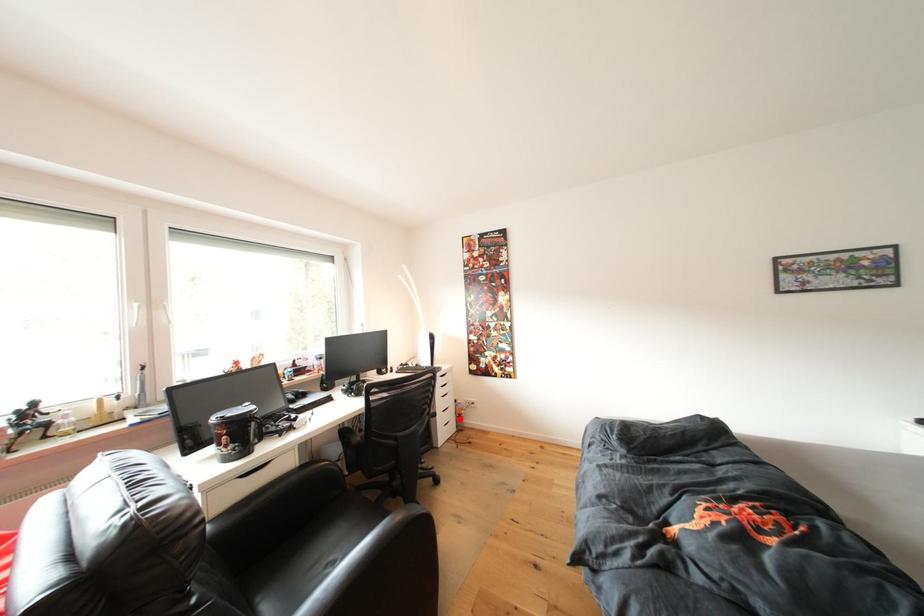
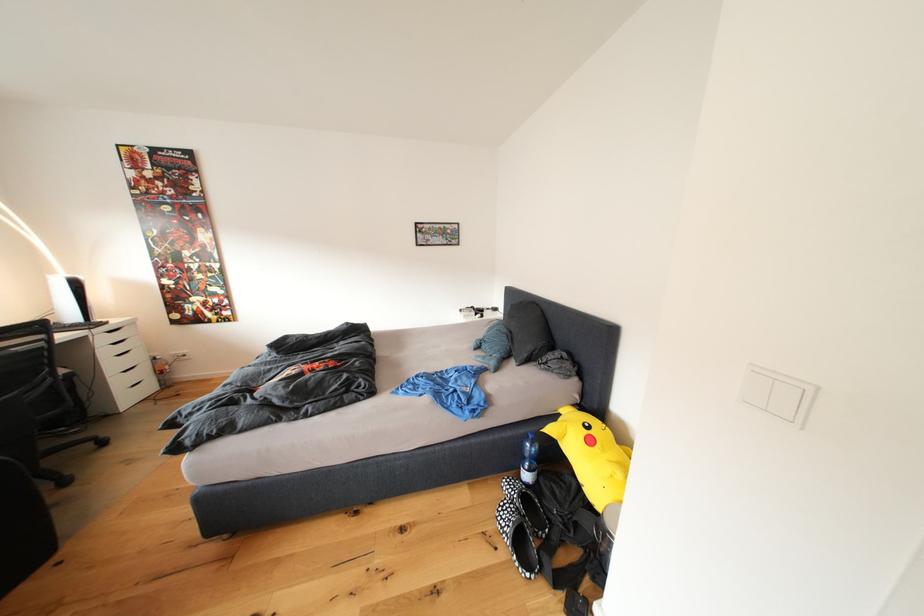
Where in the second image is the point corresponding to the highlighted location from the first image?

(152, 379)